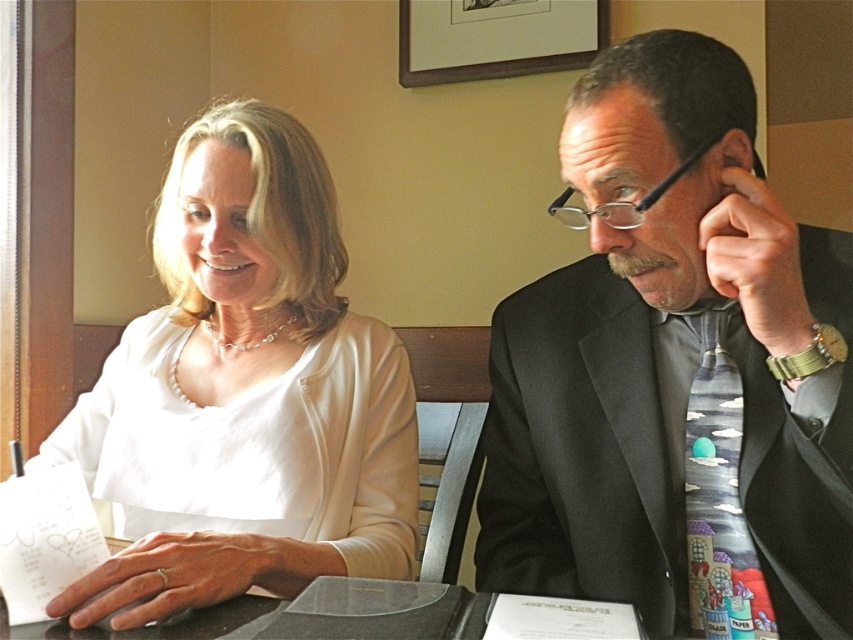
Question: Can you confirm if matte black suit at right is positioned to the right of white matte blouse at upper left?

Choices:
 (A) no
 (B) yes

Answer: (B)

Question: Is matte black suit at right further to the viewer compared to white matte blouse at upper left?

Choices:
 (A) yes
 (B) no

Answer: (B)

Question: Among these points, which one is farthest from the camera?

Choices:
 (A) (270, 266)
 (B) (769, 262)

Answer: (A)

Question: Which of the following is the closest to the observer?

Choices:
 (A) white matte blouse at upper left
 (B) matte black suit at right

Answer: (B)

Question: Is matte black suit at right above white matte blouse at upper left?

Choices:
 (A) no
 (B) yes

Answer: (B)